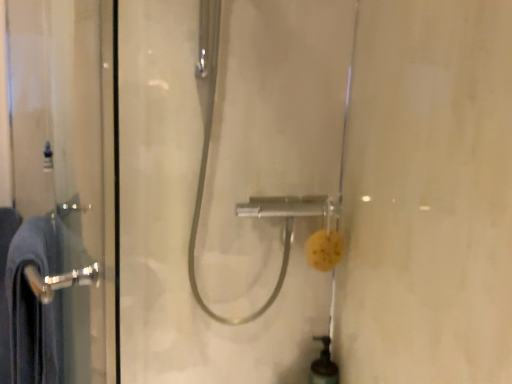
Find the location of `clear glass screen door at left`. clear glass screen door at left is located at coordinates (61, 190).

Describe the element at coordinates (61, 190) in the screenshot. I see `clear glass screen door at left` at that location.

Locate an element on the screen. This screenshot has width=512, height=384. clear glass screen door at left is located at coordinates (61, 190).